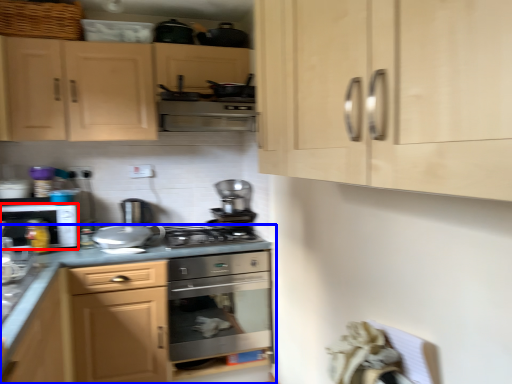
Question: Which of the following is the closest to the observer, kitchen appliance (highlighted by a red box) or cabinetry (highlighted by a blue box)?

Choices:
 (A) kitchen appliance
 (B) cabinetry

Answer: (B)